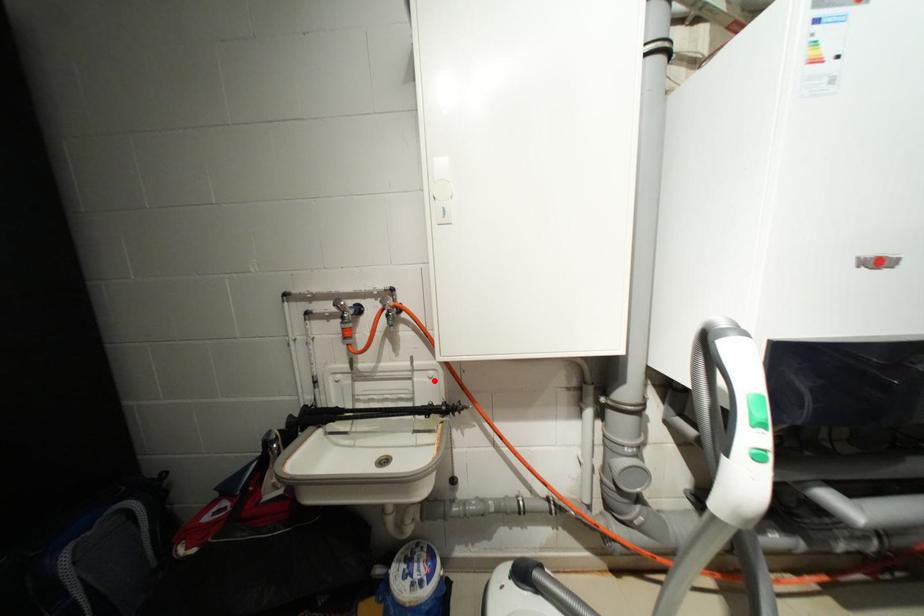
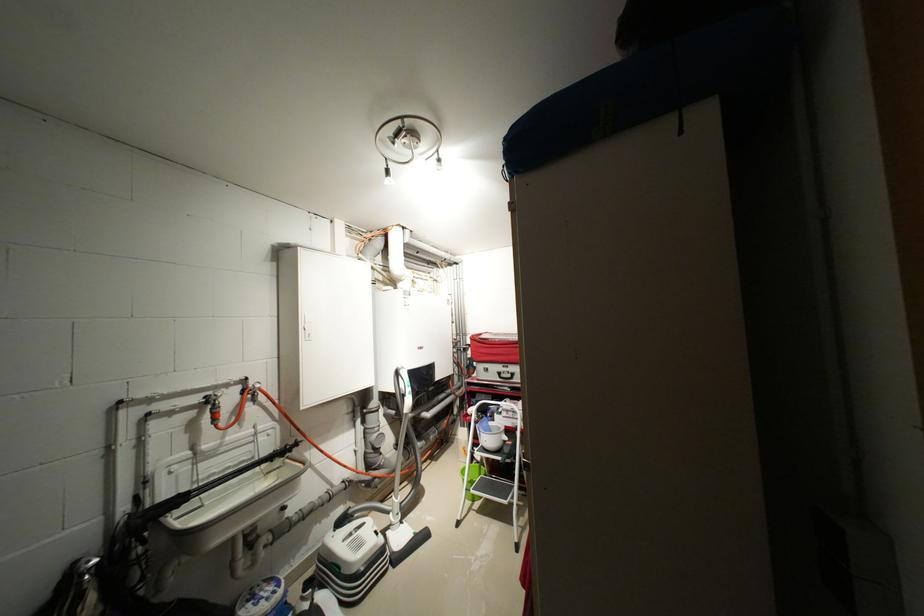
Find the pixel in the second image that matches the highlighted location in the first image.

(273, 439)